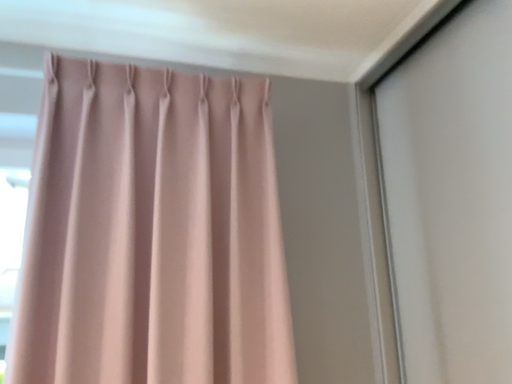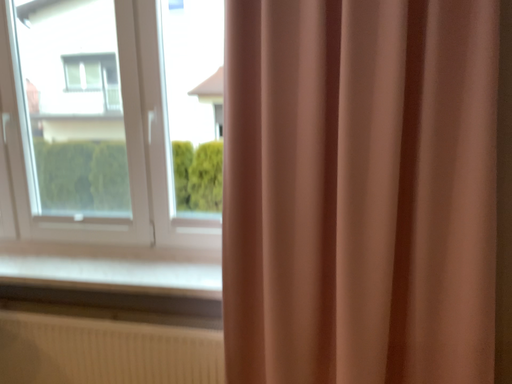
Question: How did the camera likely rotate when shooting the video?

Choices:
 (A) rotated upward
 (B) rotated downward

Answer: (B)